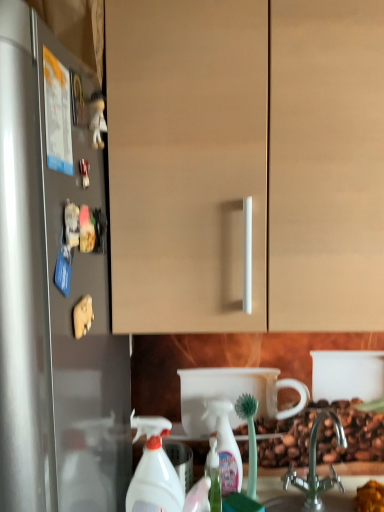
Question: Is silver metallic faucet at lower center wider or thinner than white plastic spray bottle at lower center, the 1th cleaning product viewed from the left?

Choices:
 (A) wide
 (B) thin

Answer: (A)

Question: Would you say silver metallic faucet at lower center is to the left or to the right of white plastic spray bottle at lower center, the second cleaning product viewed from the back, in the picture?

Choices:
 (A) right
 (B) left

Answer: (A)

Question: Estimate the real-world distances between objects in this image. Which object is farther from the silver metallic faucet at lower center?

Choices:
 (A) translucent plastic soap dispenser at lower center
 (B) white plastic spray bottle at lower center, the 2th cleaning product positioned from the front
 (C) white plastic spray bottle at lower center, the 1th cleaning product viewed from the left

Answer: (C)

Question: Estimate the real-world distances between objects in this image. Which object is closer to the silver metallic faucet at lower center?

Choices:
 (A) white plastic spray bottle at lower center, which is the 2th cleaning product in left-to-right order
 (B) white plastic spray bottle at lower center, which ranks as the second cleaning product in right-to-left order
 (C) translucent plastic soap dispenser at lower center

Answer: (A)